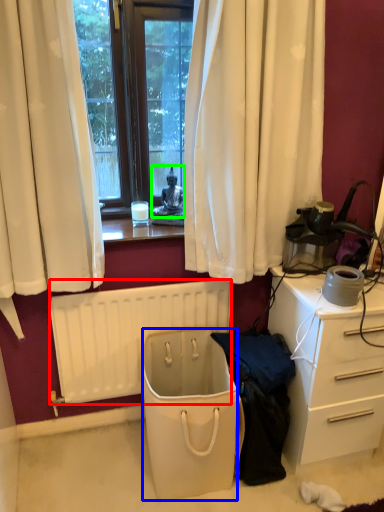
Question: Based on their relative distances, which object is farther from radiator (highlighted by a red box)? Choose from trash bin/can (highlighted by a blue box) and person (highlighted by a green box).

Choices:
 (A) trash bin/can
 (B) person

Answer: (B)